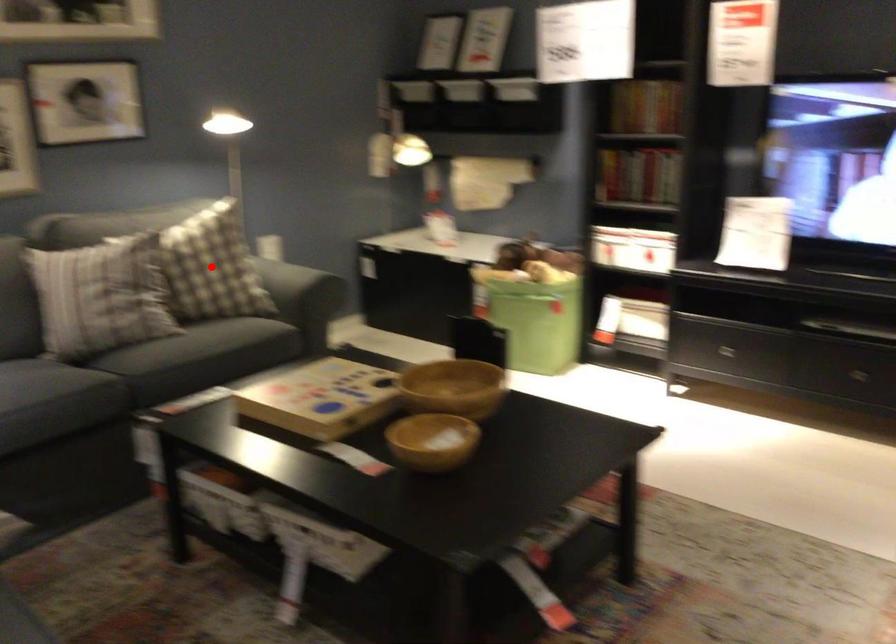
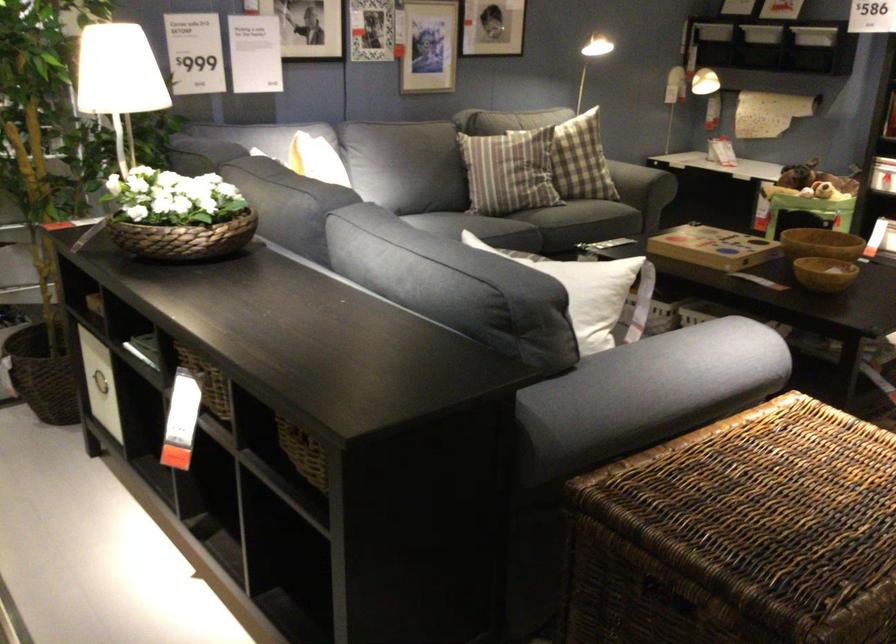
Question: I am providing you with two images of the same scene from different viewpoints. A red point is marked on the first image. At the location where the point appears in image 1, is it still visible in image 2?

Choices:
 (A) Yes
 (B) No

Answer: (B)